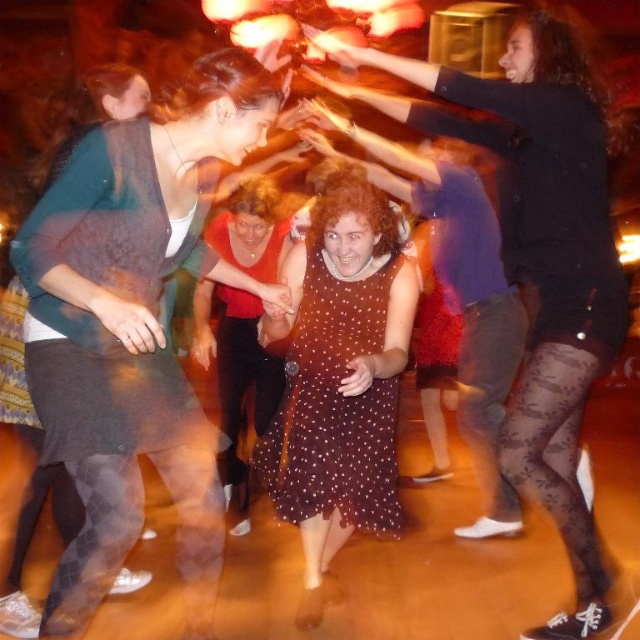
Between point (81, 560) and point (132, 176), which one is positioned behind?

The point (81, 560) is behind.

Can you confirm if matte black skirt at left is smaller than dark brown textured dress at left?

Actually, matte black skirt at left might be larger than dark brown textured dress at left.

Locate an element on the screen. The width and height of the screenshot is (640, 640). matte black skirt at left is located at coordinates (134, 326).

Which of these two, matte black skirt at left or brown dotted dress at center, stands shorter?

Standing shorter between the two is brown dotted dress at center.

Does matte black skirt at left have a larger size compared to brown dotted dress at center?

Yes, matte black skirt at left is bigger than brown dotted dress at center.

Measure the distance between matte black skirt at left and camera.

matte black skirt at left and camera are 1.75 meters apart from each other.

This screenshot has height=640, width=640. In order to click on matte black skirt at left in this screenshot , I will do `click(134, 326)`.

Is dark brown textured dress at left bigger than brown dotted dress at center?

Indeed, dark brown textured dress at left has a larger size compared to brown dotted dress at center.

Does dark brown textured dress at left appear on the left side of brown dotted dress at center?

Yes, dark brown textured dress at left is to the left of brown dotted dress at center.

Describe the element at coordinates (108, 289) in the screenshot. I see `dark brown textured dress at left` at that location.

Locate an element on the screen. Image resolution: width=640 pixels, height=640 pixels. dark brown textured dress at left is located at coordinates (108, 289).